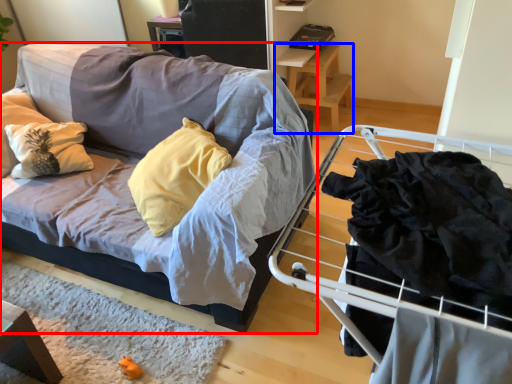
Question: Which object appears closest to the camera in this image, studio couch (highlighted by a red box) or table (highlighted by a blue box)?

Choices:
 (A) studio couch
 (B) table

Answer: (A)